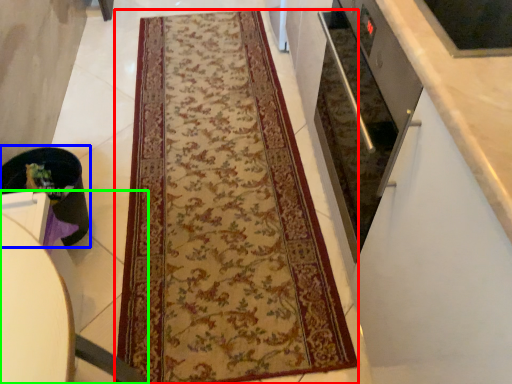
Question: Based on their relative distances, which object is farther from mat (highlighted by a red box)? Choose from appliance (highlighted by a blue box) and furniture (highlighted by a green box).

Choices:
 (A) appliance
 (B) furniture

Answer: (B)